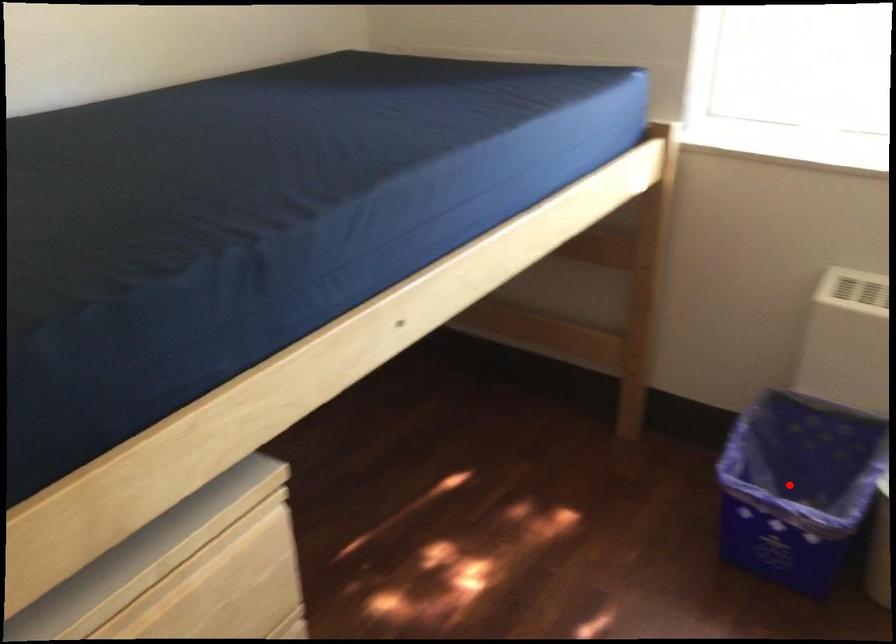
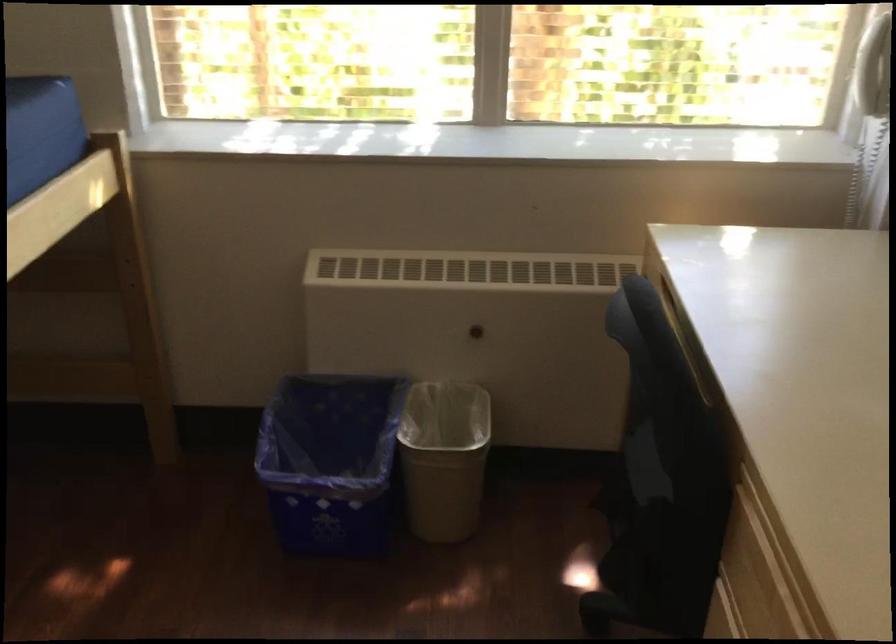
Locate, in the second image, the point that corresponds to the highlighted location in the first image.

(330, 462)